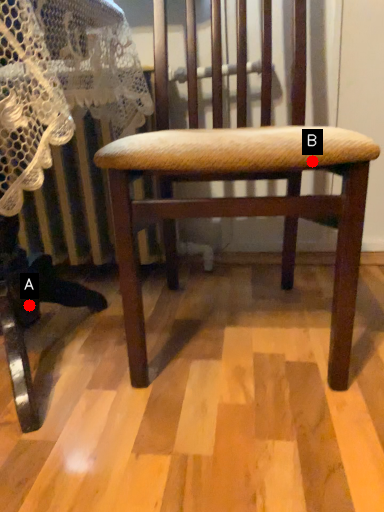
Question: Two points are circled on the image, labeled by A and B beside each circle. Which point is closer to the camera?

Choices:
 (A) A is closer
 (B) B is closer

Answer: (B)